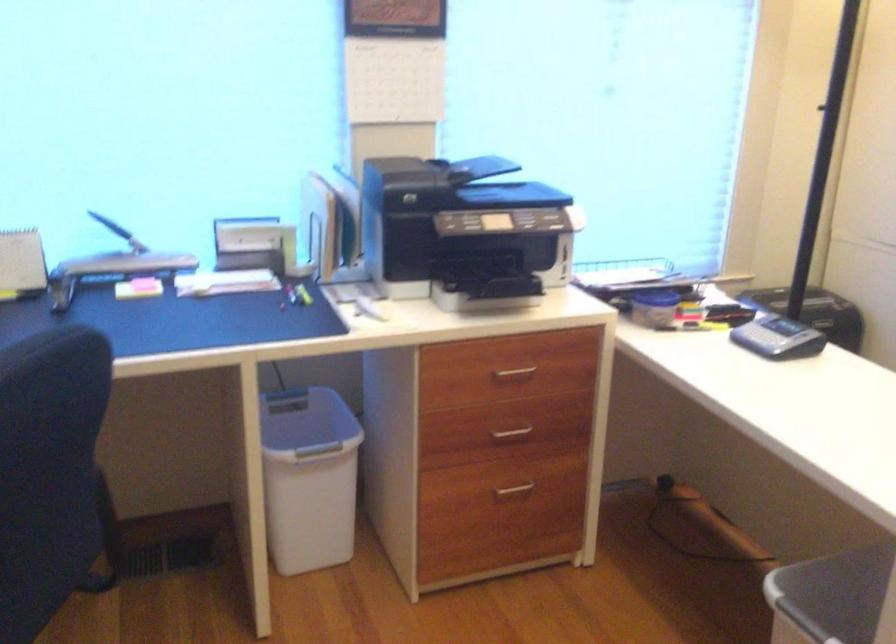
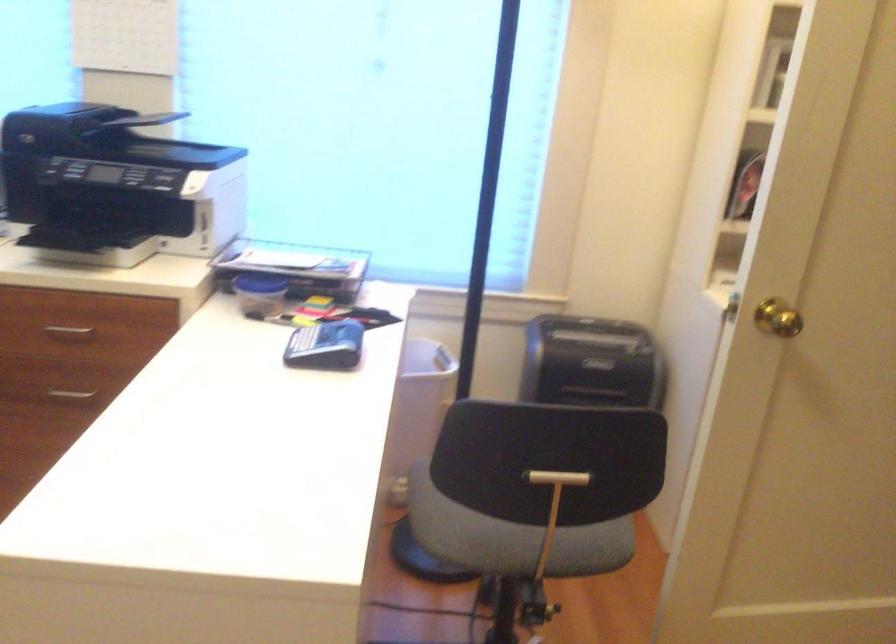
Question: Which direction would the cameraman need to move to produce the second image? Reply with the corresponding letter.

Choices:
 (A) Left
 (B) Right
 (C) Forward
 (D) Backward

Answer: (B)